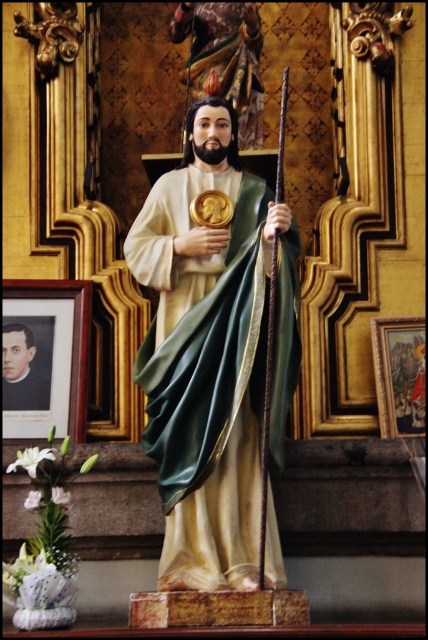
You are an art restorer examining the statue and its surroundings. You notice the green satin robe at center and the smooth black portrait at lower left. Which object is located to the right of the other?

The green satin robe at center is positioned on the right side of smooth black portrait at lower left.

You are an art restorer examining the religious statue. You need to access both the green satin robe at center and the smooth black portrait at lower left. Which object is positioned higher in the image?

The green satin robe at center is located above the smooth black portrait at lower left, so it is positioned higher in the image.